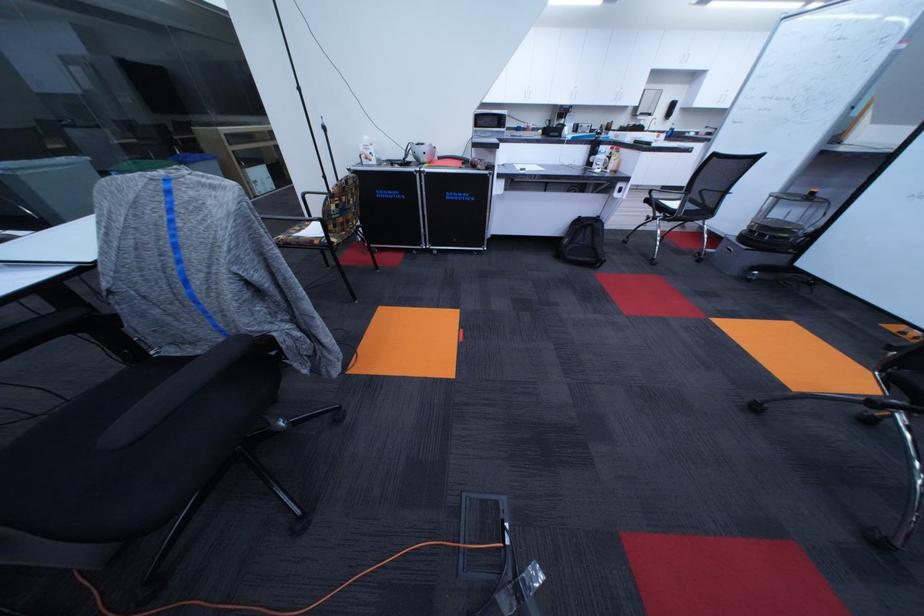
Image resolution: width=924 pixels, height=616 pixels. Describe the element at coordinates (310, 230) in the screenshot. I see `the black mesh chair sitting surface` at that location.